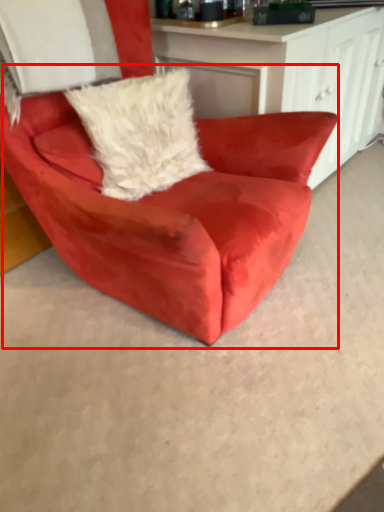
Question: From the image's perspective, what is the correct spatial positioning of chair (annotated by the red box) in reference to pillow?

Choices:
 (A) below
 (B) above

Answer: (A)